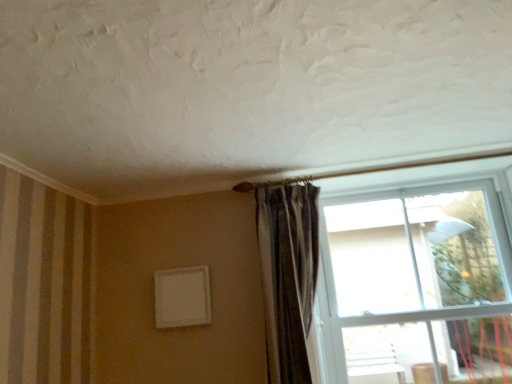
Question: Is transparent glass window at upper right at the left side of striped fabric curtain at center?

Choices:
 (A) yes
 (B) no

Answer: (B)

Question: Does transparent glass window at upper right have a lesser height compared to striped fabric curtain at center?

Choices:
 (A) yes
 (B) no

Answer: (B)

Question: Can you confirm if transparent glass window at upper right is positioned to the right of striped fabric curtain at center?

Choices:
 (A) yes
 (B) no

Answer: (A)

Question: Considering the relative sizes of transparent glass window at upper right and striped fabric curtain at center in the image provided, is transparent glass window at upper right smaller than striped fabric curtain at center?

Choices:
 (A) yes
 (B) no

Answer: (B)

Question: Can you confirm if transparent glass window at upper right is taller than striped fabric curtain at center?

Choices:
 (A) yes
 (B) no

Answer: (A)

Question: Is transparent glass window at upper right facing towards striped fabric curtain at center?

Choices:
 (A) yes
 (B) no

Answer: (B)

Question: Is striped fabric curtain at center to the right of transparent glass window at upper right from the viewer's perspective?

Choices:
 (A) yes
 (B) no

Answer: (B)

Question: Would you say striped fabric curtain at center is a long distance from transparent glass window at upper right?

Choices:
 (A) no
 (B) yes

Answer: (A)

Question: Can you confirm if striped fabric curtain at center is taller than transparent glass window at upper right?

Choices:
 (A) no
 (B) yes

Answer: (A)

Question: Is striped fabric curtain at center bigger than transparent glass window at upper right?

Choices:
 (A) no
 (B) yes

Answer: (A)

Question: From the image's perspective, is striped fabric curtain at center on transparent glass window at upper right?

Choices:
 (A) no
 (B) yes

Answer: (B)

Question: Is transparent glass window at upper right inside striped fabric curtain at center?

Choices:
 (A) no
 (B) yes

Answer: (A)

Question: Considering their positions, is striped fabric curtain at center located in front of or behind transparent glass window at upper right?

Choices:
 (A) front
 (B) behind

Answer: (B)